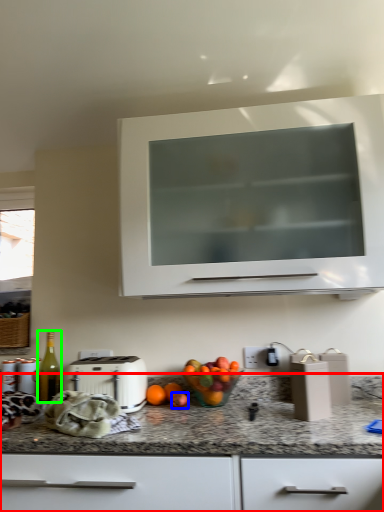
Question: Based on their relative distances, which object is farther from countertop (highlighted by a red box)? Choose from apple (highlighted by a blue box) and bottle (highlighted by a green box).

Choices:
 (A) apple
 (B) bottle

Answer: (B)